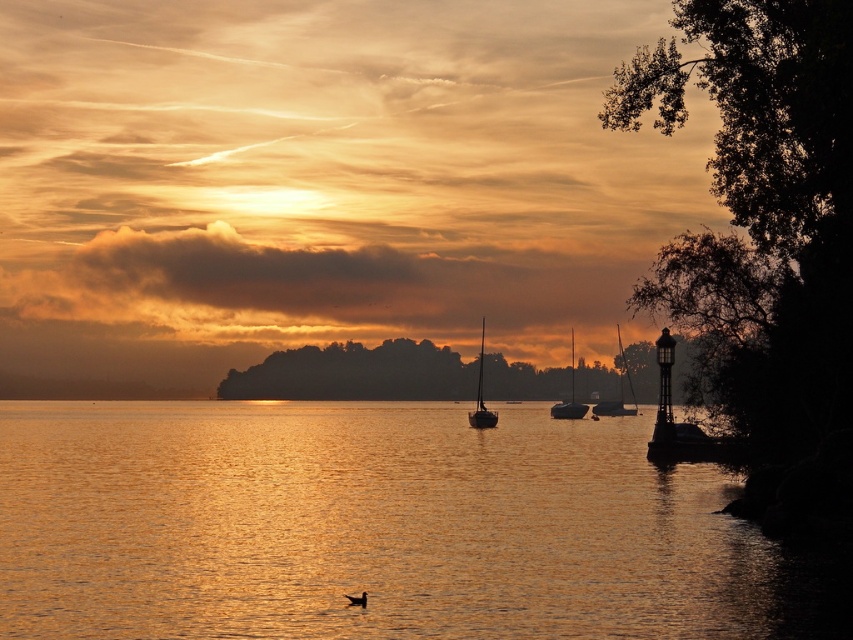
Question: Which point is closer to the camera?

Choices:
 (A) (622, 410)
 (B) (489, 419)
 (C) (363, 593)

Answer: (C)

Question: Which object is closer to the camera taking this photo?

Choices:
 (A) golden reflective water at center
 (B) smooth white sailboat at center
 (C) silvery metallic bird at lower center

Answer: (A)

Question: Is golden reflective water at center to the left of smooth white sailboat at center from the viewer's perspective?

Choices:
 (A) no
 (B) yes

Answer: (B)

Question: Does golden reflective water at center appear under satin black sailboat at center?

Choices:
 (A) yes
 (B) no

Answer: (A)

Question: Is shiny silver sailboat at center bigger than silvery metallic bird at lower center?

Choices:
 (A) no
 (B) yes

Answer: (B)

Question: Which of the following is the closest to the observer?

Choices:
 (A) smooth white sailboat at center
 (B) golden reflective water at center

Answer: (B)